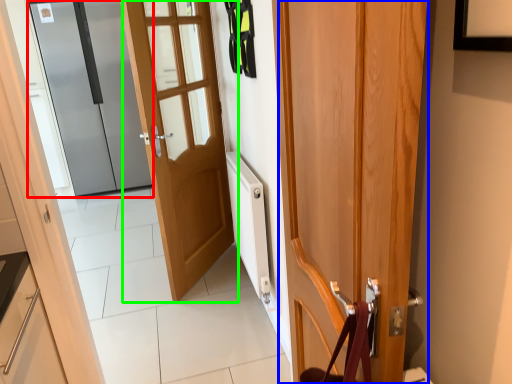
Question: Which object is the closest to the door (highlighted by a red box)? Choose among these: door (highlighted by a blue box) or door (highlighted by a green box).

Choices:
 (A) door
 (B) door

Answer: (B)